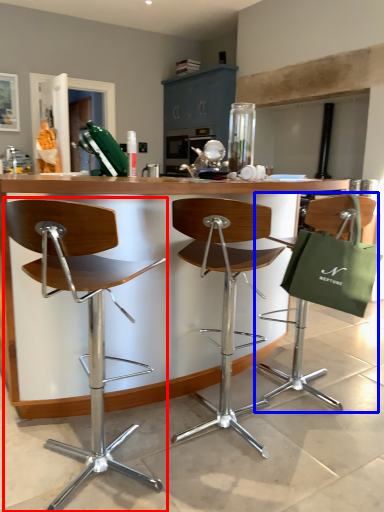
Question: Which object appears closest to the camera in this image, chair (highlighted by a red box) or chair (highlighted by a blue box)?

Choices:
 (A) chair
 (B) chair

Answer: (A)